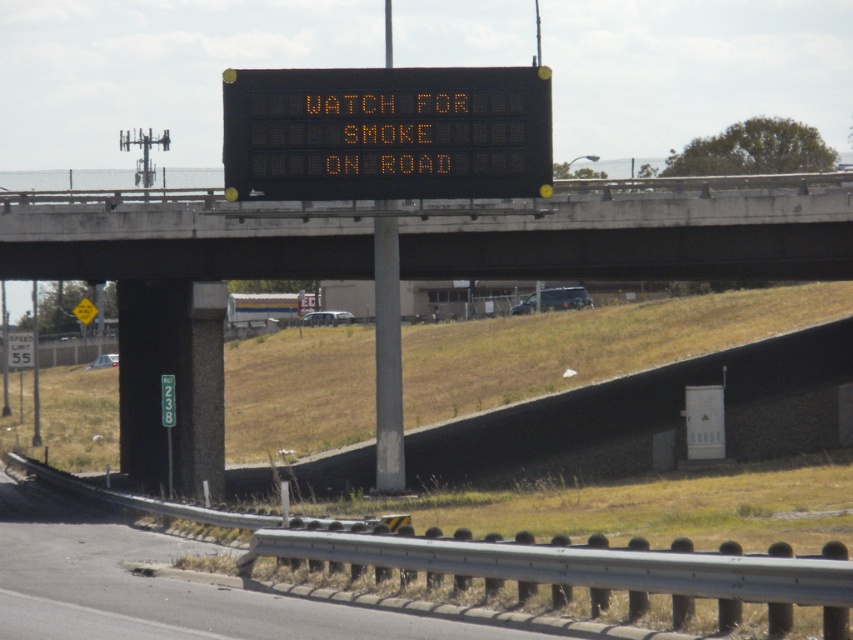
Question: Which object is positioned closest to the concrete at upper center?

Choices:
 (A) black concrete overpass at upper center
 (B) black electronic display at upper center

Answer: (A)

Question: Is concrete at upper center further to the viewer compared to black electronic display at upper center?

Choices:
 (A) no
 (B) yes

Answer: (B)

Question: Which point is closer to the camera?

Choices:
 (A) black electronic display at upper center
 (B) black concrete overpass at upper center
 (C) concrete at upper center

Answer: (A)

Question: From the image, what is the correct spatial relationship of concrete at upper center in relation to black electronic display at upper center?

Choices:
 (A) above
 (B) below

Answer: (B)

Question: Which point is closer to the camera?

Choices:
 (A) black electronic display at upper center
 (B) concrete at upper center

Answer: (A)

Question: Is concrete at upper center thinner than black concrete overpass at upper center?

Choices:
 (A) yes
 (B) no

Answer: (B)